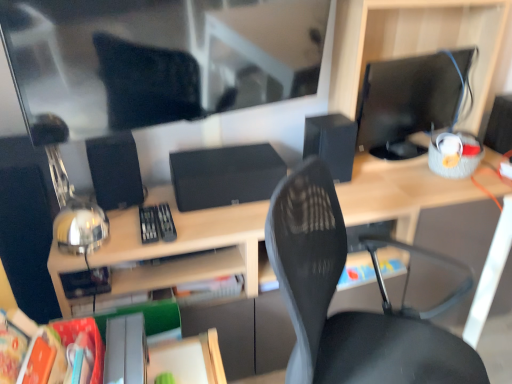
Question: From the image's perspective, relative to orange matte paper at lower left, which ranks as the second paperback book in back-to-front order, is black matte speaker at right, positioned as the 3th speaker in left-to-right order, above or below?

Choices:
 (A) below
 (B) above

Answer: (B)

Question: Relative to orange matte paper at lower left, which ranks as the second paperback book in back-to-front order, is black matte speaker at right, acting as the 1th speaker starting from the right, in front or behind?

Choices:
 (A) behind
 (B) front

Answer: (A)

Question: Estimate the real-world distances between objects in this image. Which object is farther from the orange matte paper at lower left, which ranks as the second paperback book in back-to-front order?

Choices:
 (A) matte black monitor at right
 (B) wooden desk at center
 (C) black matte speaker at right, positioned as the 3th speaker in left-to-right order
 (D) hardcover book at center, positioned as the second paperback book in left-to-right order
 (E) matte blue book at center

Answer: (C)

Question: Considering the real-world distances, which object is farthest from the matte blue book at center?

Choices:
 (A) black matte speaker at center, which ranks as the second speaker in left-to-right order
 (B) black matte speaker at left, which is counted as the 1th speaker, starting from the left
 (C) wooden desk at center
 (D) orange matte paper at lower left, the 2th paperback book when ordered from right to left
 (E) black matte speaker at right, positioned as the 3th speaker in left-to-right order

Answer: (D)